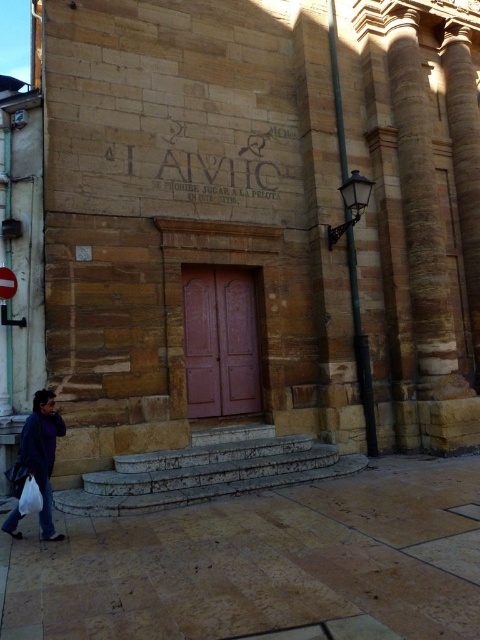
Find the location of a particular element. brown stone pavement at lower center is located at coordinates (263, 563).

Can you confirm if brown stone pavement at lower center is smaller than stone engraving at center?

Indeed, brown stone pavement at lower center has a smaller size compared to stone engraving at center.

Which is behind, point (359, 538) or point (267, 157)?

The point (267, 157) is more distant.

Find the location of a particular element. This screenshot has width=480, height=640. brown stone pavement at lower center is located at coordinates (263, 563).

Is stone engraving at center positioned at the back of denim jacket at lower left?

Yes.

Who is more forward, (152, 195) or (43, 531)?

Point (43, 531) is in front.

Locate an element on the screen. The width and height of the screenshot is (480, 640). stone engraving at center is located at coordinates (206, 168).

Does stone engraving at center appear under metallic street sign at lower left?

Incorrect, stone engraving at center is not positioned below metallic street sign at lower left.

Between stone engraving at center and metallic street sign at lower left, which one has more height?

With more height is stone engraving at center.

Find the location of a particular element. The width and height of the screenshot is (480, 640). stone engraving at center is located at coordinates (206, 168).

Where is `stone engraving at center`? The height and width of the screenshot is (640, 480). stone engraving at center is located at coordinates (206, 168).